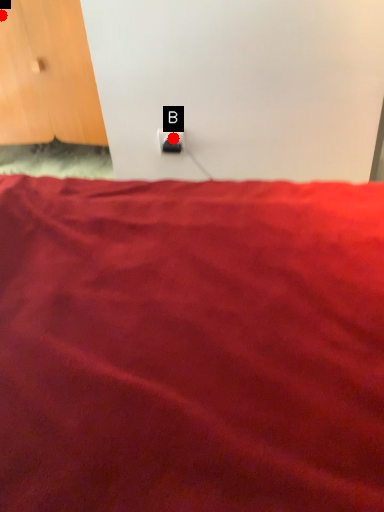
Question: Two points are circled on the image, labeled by A and B beside each circle. Which point is closer to the camera?

Choices:
 (A) A is closer
 (B) B is closer

Answer: (B)